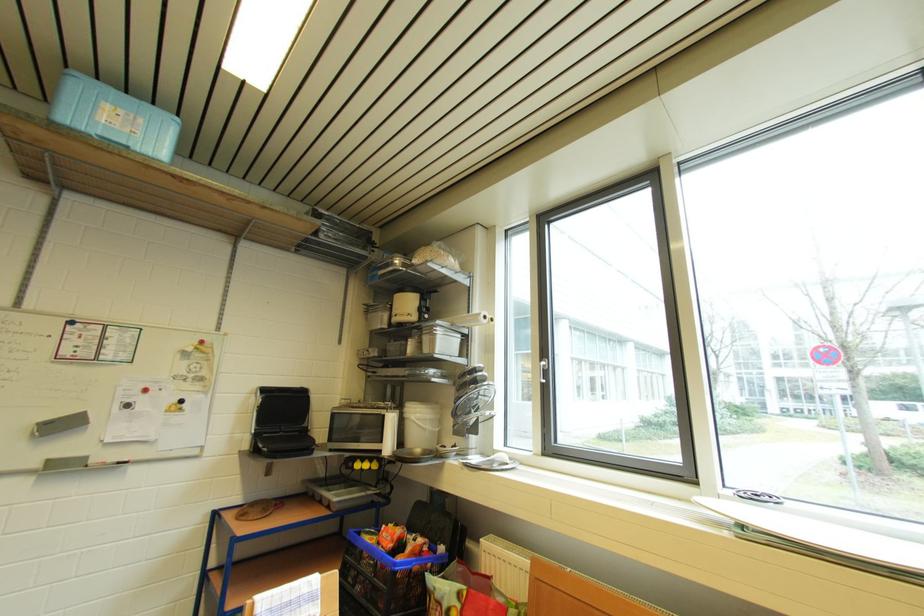
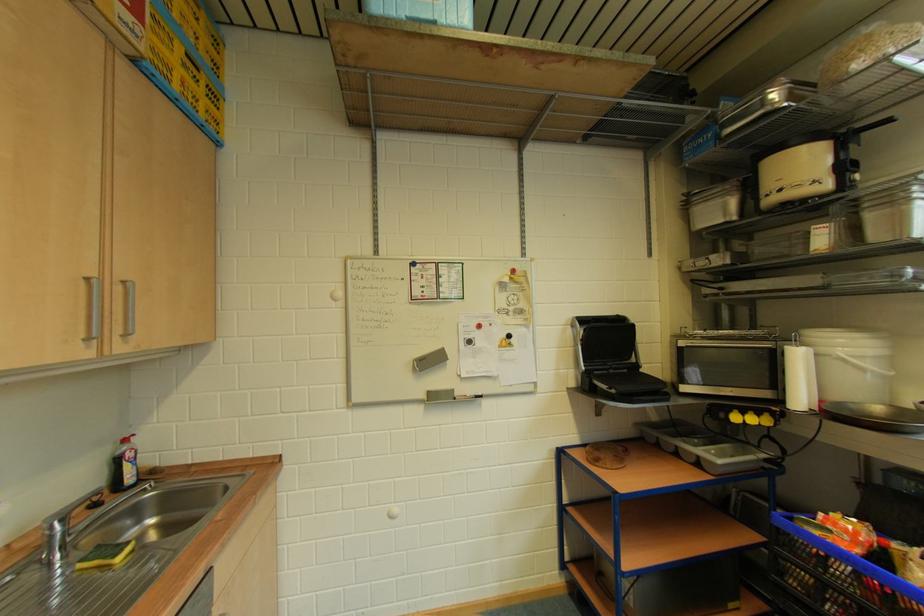
Where in the second image is the point corresponding to pixel 423 422 from the first image?

(858, 360)